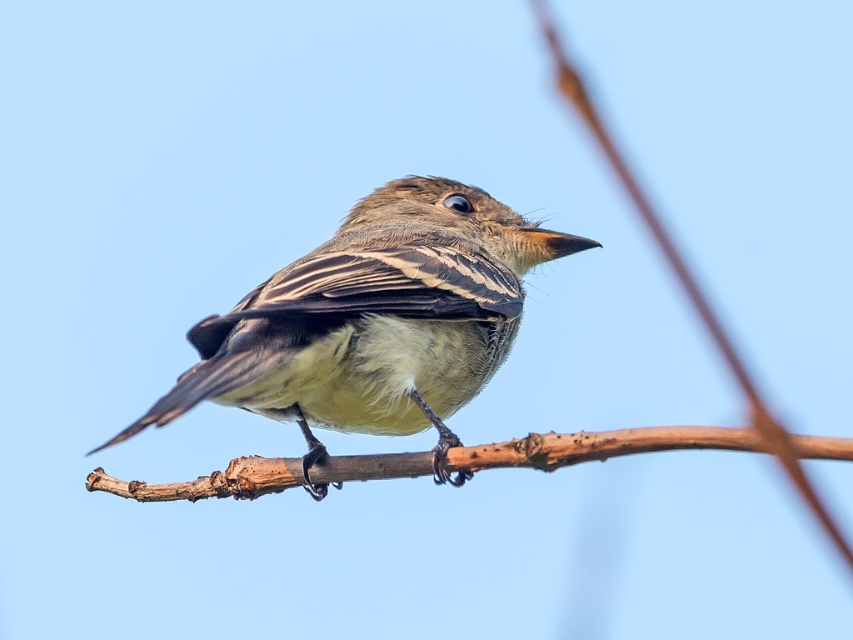
You are standing in a park and see the brown feathered bird at center and the brown rough branch at center. Which object is positioned more to the left?

The brown feathered bird at center is positioned to the left of the brown rough branch at center, so it is more to the left.

You are an ornithologist observing the brown feathered bird at center and the brown rough branch at center. Which object has a smaller width?

The brown feathered bird at center is thinner than the brown rough branch at center, so the brown feathered bird at center has a smaller width.

You are a birdwatcher observing the brown feathered bird at center and the brown rough branch at center. Which object is taller?

The brown feathered bird at center is much taller than the brown rough branch at center.